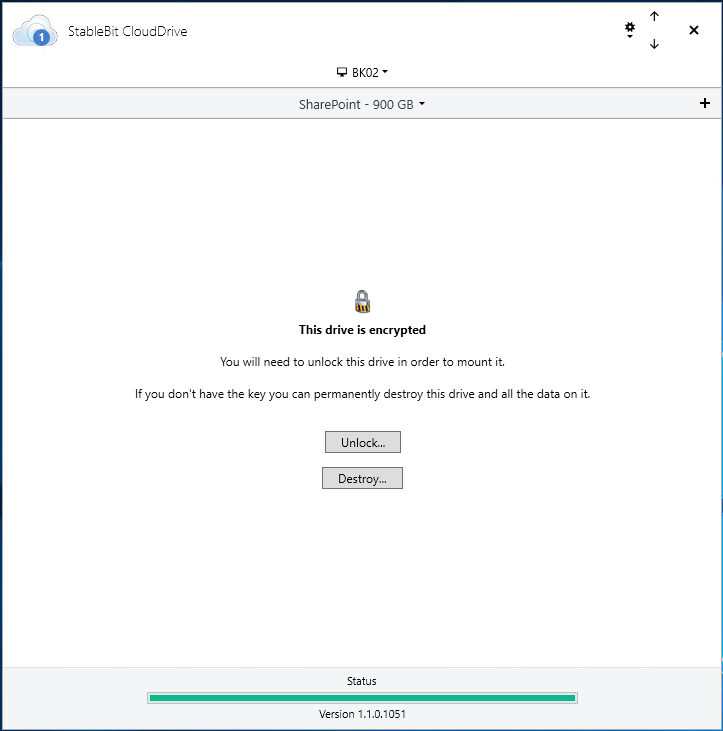
This screenshot has width=723, height=731. Identify the location of lock. (363, 300).